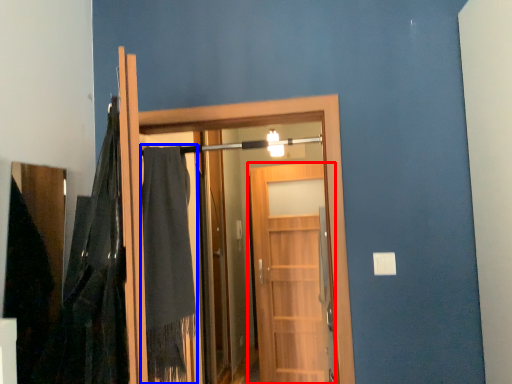
Question: Which point is closer to the camera, door (highlighted by a red box) or robe (highlighted by a blue box)?

Choices:
 (A) door
 (B) robe

Answer: (B)